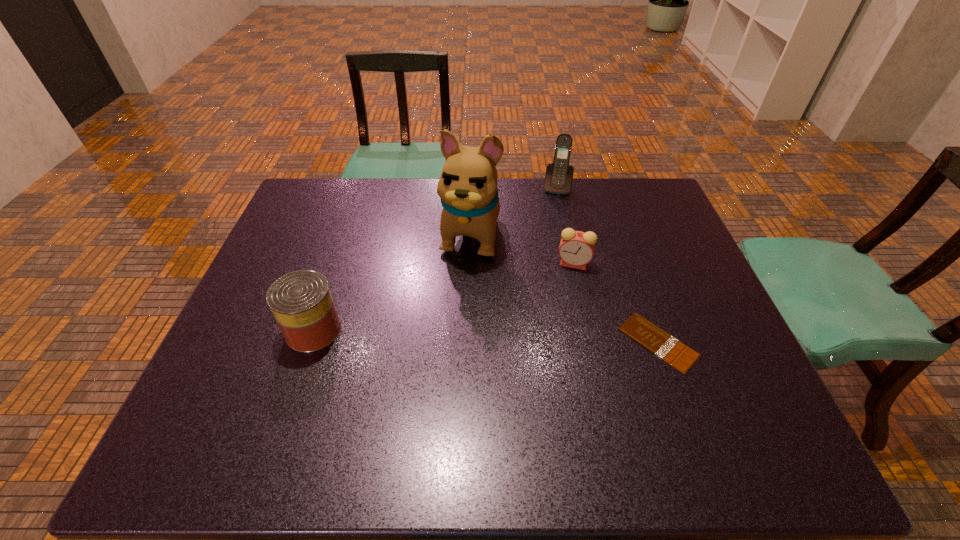
The height and width of the screenshot is (540, 960). In order to click on vacant space located 0.070m on the front of the rightmost object in this screenshot , I will do `click(680, 403)`.

Where is `vacant space located on the face of the puppy`? This screenshot has height=540, width=960. vacant space located on the face of the puppy is located at coordinates (435, 359).

Find the location of `free space located on the face of the puppy`. free space located on the face of the puppy is located at coordinates (452, 305).

The height and width of the screenshot is (540, 960). I want to click on vacant position located on the face of the puppy, so click(445, 325).

At what (x,y) coordinates should I click in order to perform the action: click on vacant space located 0.080m on the face of the second shortest object. Please return your answer as a coordinate pair (x, y). This screenshot has width=960, height=540. Looking at the image, I should click on (538, 280).

Identify the location of vacant position located on the face of the second shortest object. [517, 290].

Image resolution: width=960 pixels, height=540 pixels. Identify the location of blank area located on the face of the second shortest object. (517, 290).

You are a GUI agent. You are given a task and a screenshot of the screen. Output one action in this format:
    pyautogui.click(x=<x>, y=<y>)
    Task: Click on the vacant space located 0.250m on the front-facing side of the cellular telephone
    Image resolution: width=960 pixels, height=540 pixels.
    Given the screenshot: What is the action you would take?
    pyautogui.click(x=546, y=243)

Locate an element on the screen. The width and height of the screenshot is (960, 540). free location located on the front-facing side of the cellular telephone is located at coordinates (x=540, y=270).

Locate an element on the screen. vacant space located 0.360m on the front-facing side of the cellular telephone is located at coordinates (541, 268).